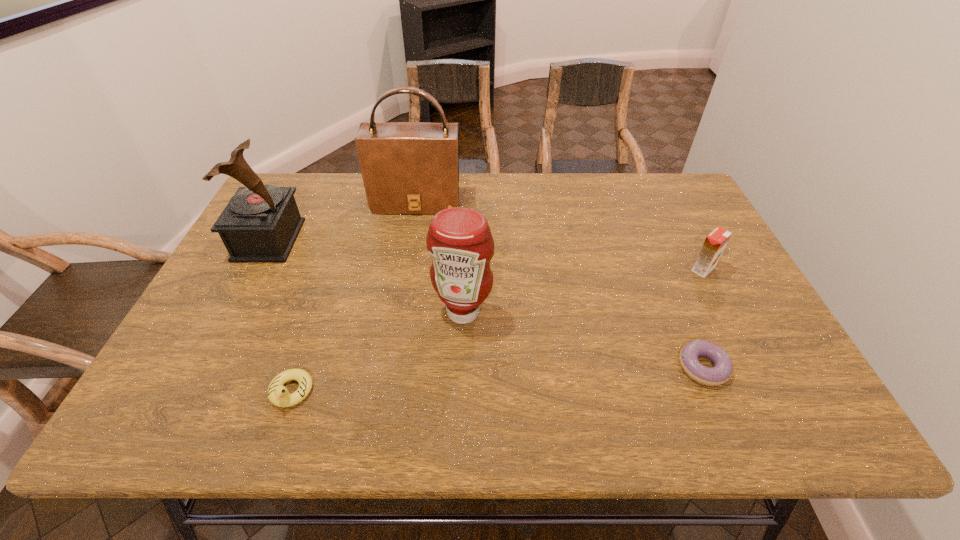
Where is `free space between the shortest object and the orange juice`? free space between the shortest object and the orange juice is located at coordinates (703, 318).

Identify the location of unoccupied area between the condiment and the shortest object. (583, 339).

In order to click on empty location between the condiment and the rightmost object in this screenshot , I will do pyautogui.click(x=583, y=291).

Find the location of a particular element. This screenshot has height=540, width=960. vacant space in between the rightmost object and the shoulder bag is located at coordinates (560, 236).

Locate an element on the screen. The height and width of the screenshot is (540, 960). vacant area that lies between the shoulder bag and the phonograph_record is located at coordinates (343, 221).

Locate which object is the fourth closest to the shoulder bag. Please provide its 2D coordinates. Your answer should be formatted as a tuple, i.e. [(x, y)], where the tuple contains the x and y coordinates of a point satisfying the conditions above.

[(715, 243)]

Identify which object is the second nearest to the condiment. Please provide its 2D coordinates. Your answer should be formatted as a tuple, i.e. [(x, y)], where the tuple contains the x and y coordinates of a point satisfying the conditions above.

[(407, 167)]

This screenshot has width=960, height=540. I want to click on vacant position in the image that satisfies the following two spatial constraints: 1. on the front flap of the shoulder bag; 2. at the horn opening of the leftmost object, so click(x=410, y=240).

You are a GUI agent. You are given a task and a screenshot of the screen. Output one action in this format:
    pyautogui.click(x=<x>, y=<y>)
    Task: Click on the free space in the image that satisfies the following two spatial constraints: 1. at the horn opening of the condiment; 2. on the left side of the leftmost object
    The width and height of the screenshot is (960, 540).
    Given the screenshot: What is the action you would take?
    pyautogui.click(x=231, y=312)

Locate an element on the screen. This screenshot has height=540, width=960. blank area in the image that satisfies the following two spatial constraints: 1. at the horn opening of the second object from right to left; 2. on the left side of the phonograph_record is located at coordinates (203, 367).